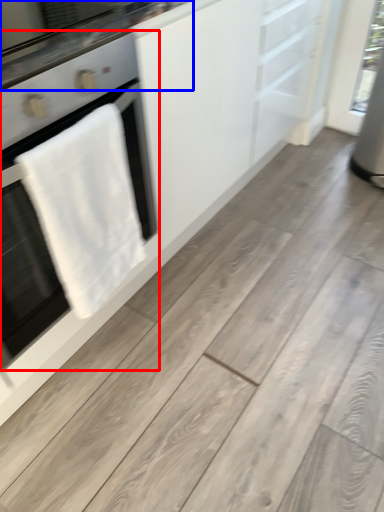
Question: Among these objects, which one is farthest to the camera, home appliance (highlighted by a red box) or countertop (highlighted by a blue box)?

Choices:
 (A) home appliance
 (B) countertop

Answer: (B)